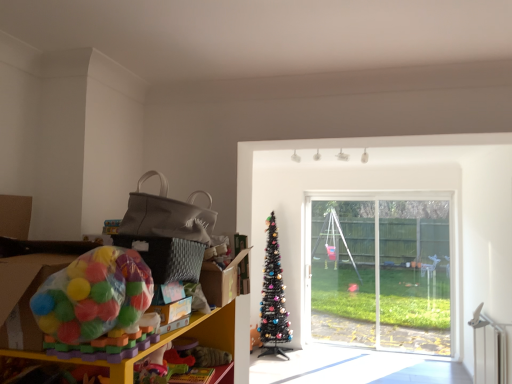
Locate an element on the screen. The height and width of the screenshot is (384, 512). plastic toy at left is located at coordinates (172, 339).

This screenshot has height=384, width=512. Identify the location of transparent glass window at center. (380, 270).

Is translucent plastic ball pit at left next to black artificial christmas tree at center and touching it?

translucent plastic ball pit at left and black artificial christmas tree at center are clearly separated.

Is point (122, 299) farther from camera compared to point (276, 270)?

No.

In terms of height, does translucent plastic ball pit at left look taller or shorter compared to black artificial christmas tree at center?

translucent plastic ball pit at left is shorter than black artificial christmas tree at center.

Does point (261, 307) come behind point (144, 279)?

Yes, it is behind point (144, 279).

Which object is positioned more to the left, black artificial christmas tree at center or translucent plastic ball pit at left?

From the viewer's perspective, translucent plastic ball pit at left appears more on the left side.

Could you measure the distance between black artificial christmas tree at center and translucent plastic ball pit at left?

black artificial christmas tree at center is 4.26 meters from translucent plastic ball pit at left.

Between black artificial christmas tree at center and translucent plastic ball pit at left, which one is positioned behind?

black artificial christmas tree at center is further away from the camera.

Measure the distance from translucent plastic ball pit at left to transparent glass window at center.

translucent plastic ball pit at left is 4.67 meters away from transparent glass window at center.

From the image's perspective, is translucent plastic ball pit at left below transparent glass window at center?

No, from the image's perspective, translucent plastic ball pit at left is not below transparent glass window at center.

Would you consider translucent plastic ball pit at left to be distant from transparent glass window at center?

Absolutely, translucent plastic ball pit at left is distant from transparent glass window at center.

Is translucent plastic ball pit at left aimed at transparent glass window at center?

No.

Is plastic toy at left to the right of transparent glass window at center from the viewer's perspective?

No, plastic toy at left is not to the right of transparent glass window at center.

Considering the sizes of objects plastic toy at left and transparent glass window at center in the image provided, who is smaller, plastic toy at left or transparent glass window at center?

transparent glass window at center.

Is plastic toy at left facing towards transparent glass window at center?

No, plastic toy at left is not facing towards transparent glass window at center.

Where is `shelf above the transparent glass window at center (from the image's perspective)`? Image resolution: width=512 pixels, height=384 pixels. shelf above the transparent glass window at center (from the image's perspective) is located at coordinates (172, 339).

Is transparent glass window at center positioned with its back to translucent plastic ball pit at left?

transparent glass window at center does not have its back to translucent plastic ball pit at left.

Considering the positions of point (372, 253) and point (63, 309), is point (372, 253) closer or farther from the camera than point (63, 309)?

Clearly, point (372, 253) is more distant from the camera than point (63, 309).

From the image's perspective, which one is positioned higher, transparent glass window at center or translucent plastic ball pit at left?

translucent plastic ball pit at left appears higher in the image.

Considering the sizes of objects transparent glass window at center and translucent plastic ball pit at left in the image provided, who is taller, transparent glass window at center or translucent plastic ball pit at left?

With more height is transparent glass window at center.

What's the angular difference between transparent glass window at center and plastic toy at left's facing directions?

transparent glass window at center and plastic toy at left are facing 90 degrees away from each other.

Which is closer to the camera, [444,334] or [129,377]?

Point [444,334] is farther from the camera than point [129,377].

Which is in front, transparent glass window at center or plastic toy at left?

Positioned in front is plastic toy at left.

From the image's perspective, is transparent glass window at center above plastic toy at left?

No, from the image's perspective, transparent glass window at center is not on top of plastic toy at left.

Would you consider black artificial christmas tree at center to be distant from transparent glass window at center?

Yes, black artificial christmas tree at center is far from transparent glass window at center.

Is black artificial christmas tree at center looking in the opposite direction of transparent glass window at center?

No, black artificial christmas tree at center's orientation is not away from transparent glass window at center.

From the image's perspective, which one is positioned lower, black artificial christmas tree at center or transparent glass window at center?

From the image's view, black artificial christmas tree at center is below.

Is black artificial christmas tree at center positioned beyond the bounds of transparent glass window at center?

Yes.

At what (x,y) coordinates should I click in order to perform the action: click on toy that is in front of the black artificial christmas tree at center. Please return your answer as a coordinate pair (x, y). This screenshot has height=384, width=512. Looking at the image, I should click on (94, 295).

Locate an element on the screen. The height and width of the screenshot is (384, 512). christmas tree on the right of translucent plastic ball pit at left is located at coordinates (273, 293).

Which object lies nearer to the anchor point black artificial christmas tree at center, translucent plastic ball pit at left or transparent glass window at center?

transparent glass window at center lies closer to black artificial christmas tree at center than the other object.

When comparing their distances from translucent plastic ball pit at left, does plastic toy at left or black artificial christmas tree at center seem further?

The object further to translucent plastic ball pit at left is black artificial christmas tree at center.

From the image, which object appears to be nearer to transparent glass window at center, translucent plastic ball pit at left or plastic toy at left?

plastic toy at left.

Considering their positions, is transparent glass window at center positioned further to black artificial christmas tree at center than translucent plastic ball pit at left?

translucent plastic ball pit at left.

Estimate the real-world distances between objects in this image. Which object is closer to transparent glass window at center, plastic toy at left or translucent plastic ball pit at left?

The object closer to transparent glass window at center is plastic toy at left.

Based on their spatial positions, is transparent glass window at center or plastic toy at left further from translucent plastic ball pit at left?

transparent glass window at center is further to translucent plastic ball pit at left.

Looking at the image, which one is located further to transparent glass window at center, black artificial christmas tree at center or translucent plastic ball pit at left?

Among the two, translucent plastic ball pit at left is located further to transparent glass window at center.

Looking at the image, which one is located further to transparent glass window at center, translucent plastic ball pit at left or black artificial christmas tree at center?

Based on the image, translucent plastic ball pit at left appears to be further to transparent glass window at center.

Locate an element on the screen. Image resolution: width=512 pixels, height=384 pixels. shelf between translucent plastic ball pit at left and black artificial christmas tree at center along the z-axis is located at coordinates (172, 339).

At what (x,y) coordinates should I click in order to perform the action: click on shelf positioned between translucent plastic ball pit at left and transparent glass window at center from near to far. Please return your answer as a coordinate pair (x, y). Looking at the image, I should click on (172, 339).

Find the location of a particular element. This screenshot has height=384, width=512. christmas tree positioned between plastic toy at left and transparent glass window at center from near to far is located at coordinates (273, 293).

Locate an element on the screen. The height and width of the screenshot is (384, 512). christmas tree between translucent plastic ball pit at left and transparent glass window at center in the front-back direction is located at coordinates (273, 293).